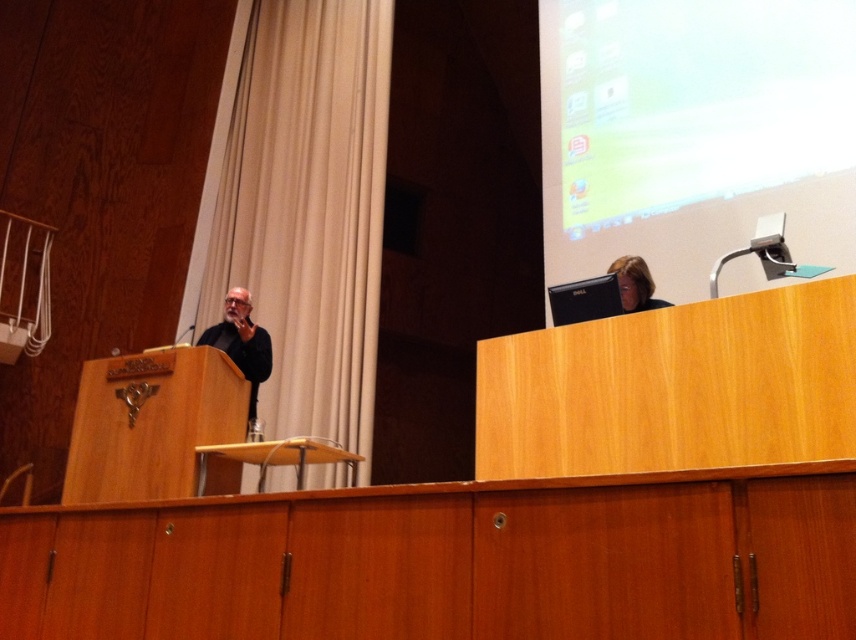
Question: Does beige fabric curtain at left lie in front of matte black laptop at upper right?

Choices:
 (A) no
 (B) yes

Answer: (A)

Question: Which point appears closest to the camera in this image?

Choices:
 (A) (233, 356)
 (B) (354, 435)
 (C) (635, 298)
 (D) (724, 90)

Answer: (C)

Question: Is beige fabric curtain at left thinner than matte black laptop at upper right?

Choices:
 (A) yes
 (B) no

Answer: (B)

Question: Does beige fabric curtain at left have a larger size compared to matte black laptop at upper right?

Choices:
 (A) yes
 (B) no

Answer: (A)

Question: Which point is closer to the camera?

Choices:
 (A) black matte jacket at left
 (B) matte plastic projection screen at upper right
 (C) matte black laptop at upper right

Answer: (C)

Question: Based on their relative distances, which object is nearer to the black matte jacket at left?

Choices:
 (A) matte plastic projection screen at upper right
 (B) matte black laptop at upper right
 (C) beige fabric curtain at left

Answer: (C)